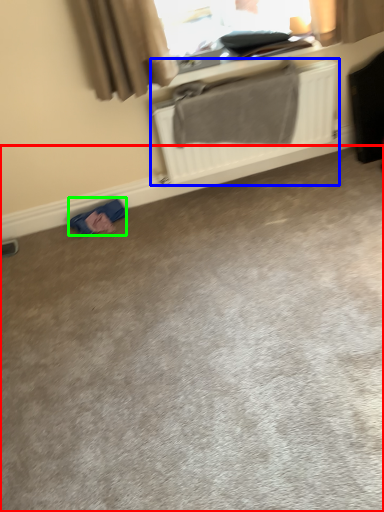
Question: Which is nearer to the concrete (highlighted by a red box)? radiator (highlighted by a blue box) or material (highlighted by a green box).

Choices:
 (A) radiator
 (B) material

Answer: (B)